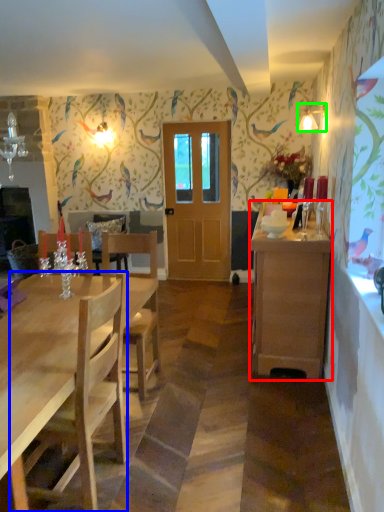
Question: Which object is positioned farthest from cabinetry (highlighted by a red box)? Select from chair (highlighted by a blue box) and lamp (highlighted by a green box).

Choices:
 (A) chair
 (B) lamp

Answer: (B)